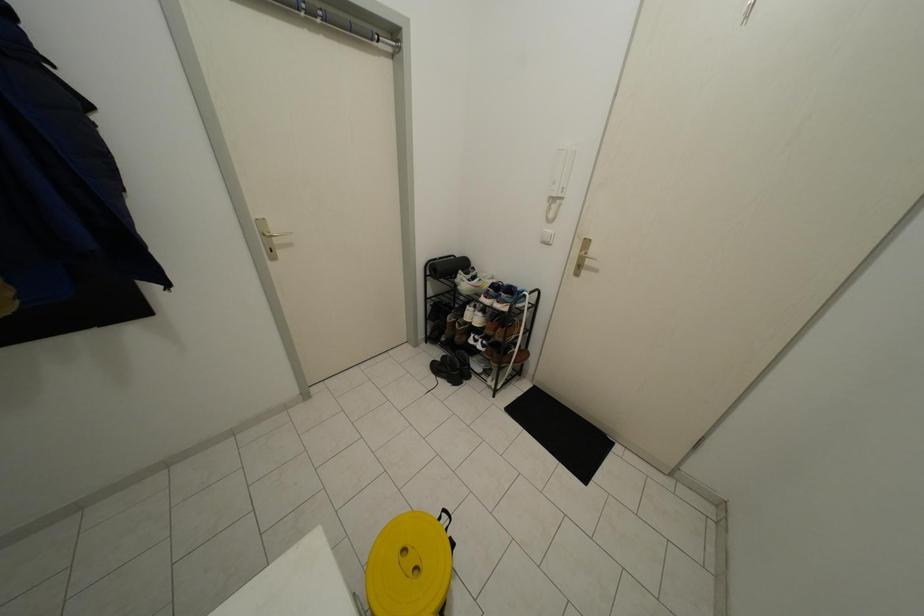
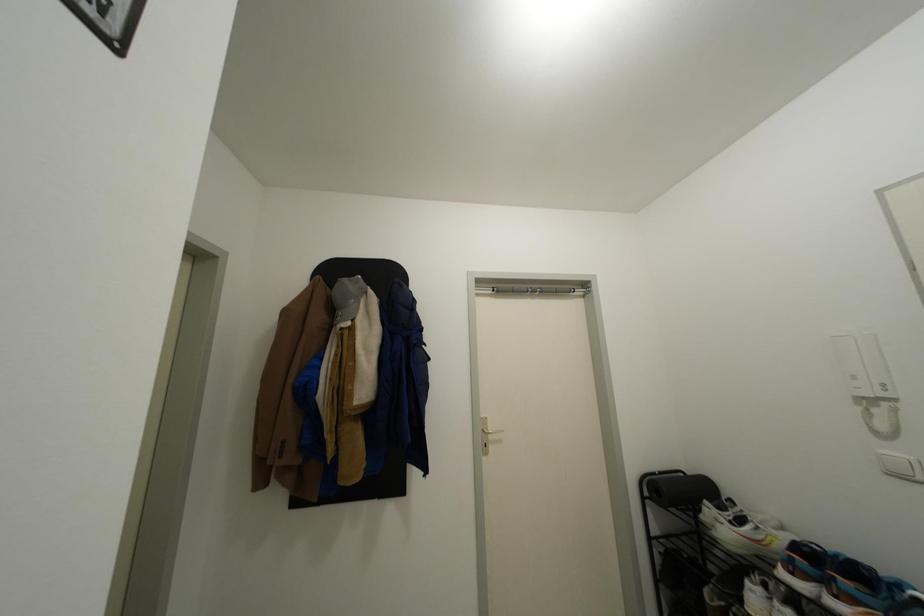
First-person continuous shooting, in which direction is the camera rotating?

The camera's rotation is toward left-up.